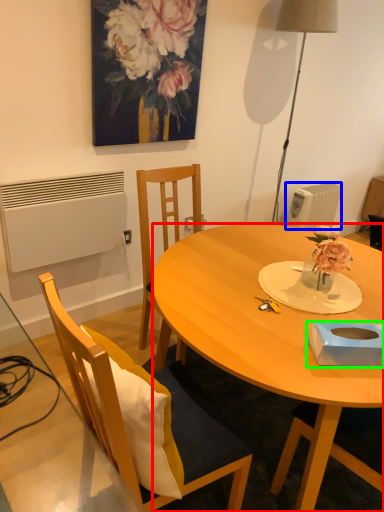
Question: Based on their relative distances, which object is farther from desk (highlighted by a red box)? Choose from radiator (highlighted by a blue box) and box (highlighted by a green box).

Choices:
 (A) radiator
 (B) box

Answer: (A)